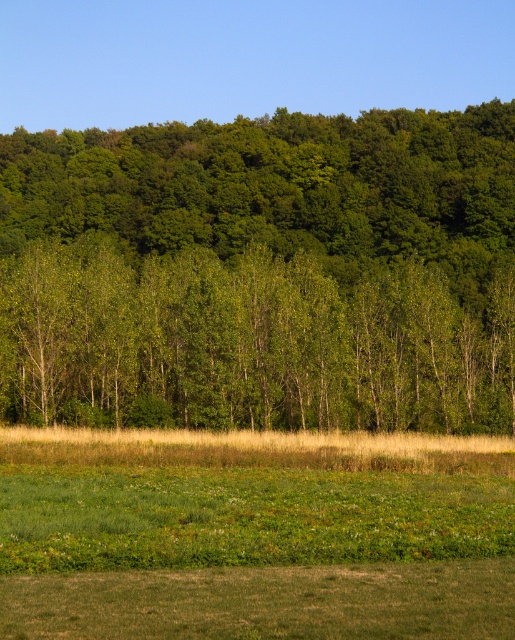
Is green leafy trees at upper center smaller than green grassy field at lower center?

No.

Does green leafy trees at upper center appear on the left side of green grassy field at lower center?

Indeed, green leafy trees at upper center is positioned on the left side of green grassy field at lower center.

Image resolution: width=515 pixels, height=640 pixels. What are the coordinates of `green leafy trees at upper center` in the screenshot? It's located at (263, 273).